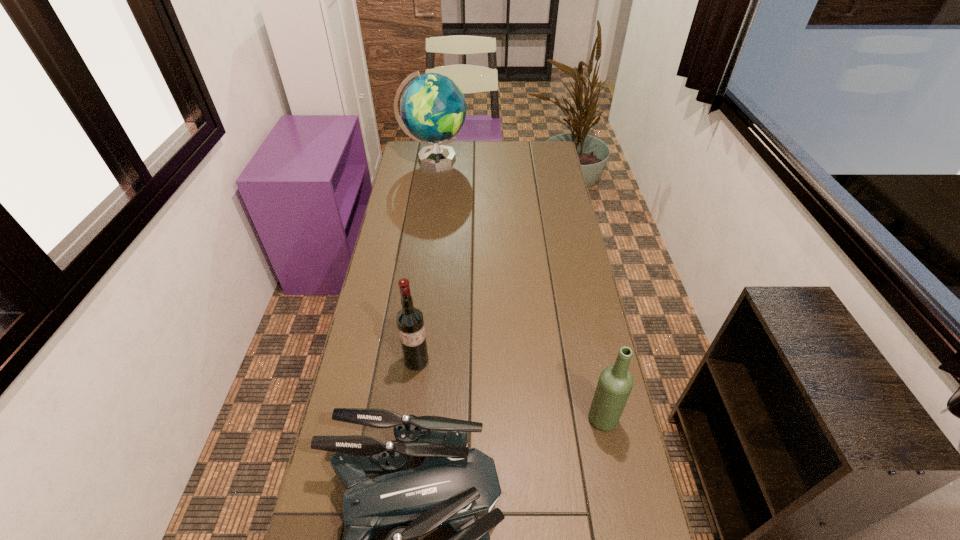
The width and height of the screenshot is (960, 540). Find the location of `the farthest object`. the farthest object is located at coordinates (433, 109).

The image size is (960, 540). In order to click on globe in this screenshot , I will do `click(433, 109)`.

In order to click on the left wine bottle in this screenshot , I will do tap(410, 323).

This screenshot has width=960, height=540. Find the location of `the third nearest object`. the third nearest object is located at coordinates (410, 323).

Where is `the nearer wine bottle`? The width and height of the screenshot is (960, 540). the nearer wine bottle is located at coordinates (615, 383).

You are a GUI agent. You are given a task and a screenshot of the screen. Output one action in this format:
    pyautogui.click(x=<x>, y=<y>)
    Task: Click on the rightmost object
    The width and height of the screenshot is (960, 540).
    Given the screenshot: What is the action you would take?
    pyautogui.click(x=615, y=383)

At what (x,y) coordinates should I click in order to perform the action: click on blank space located 0.190m on the front surface of the tallest object. Please return your answer as a coordinate pair (x, y). The width and height of the screenshot is (960, 540). Looking at the image, I should click on (508, 158).

Locate an element on the screen. The height and width of the screenshot is (540, 960). vacant space located on the front and back of the farther wine bottle is located at coordinates (414, 387).

Identify the location of vacant space located 0.170m on the left of the rightmost object. (522, 420).

Where is `object located in the far edge section of the desktop`? object located in the far edge section of the desktop is located at coordinates (433, 109).